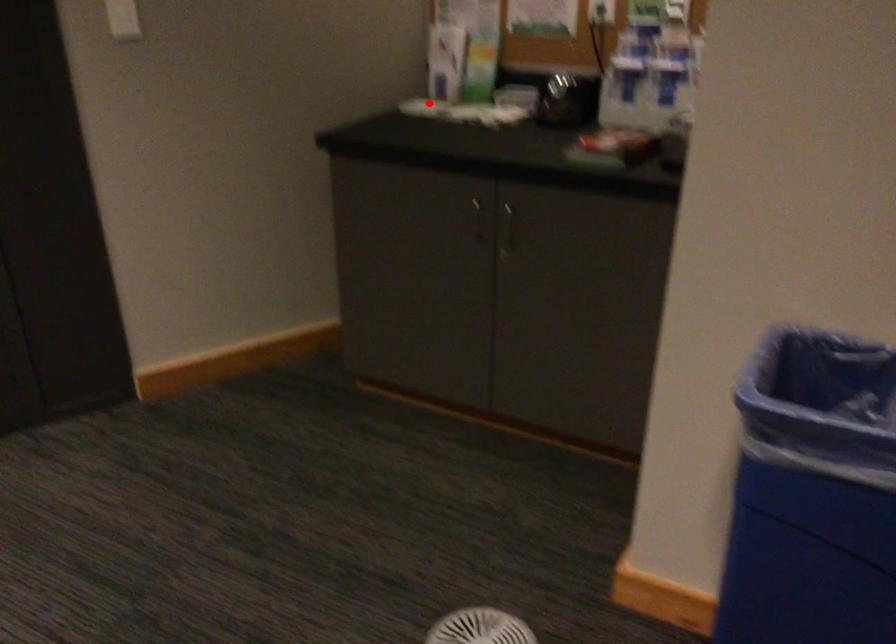
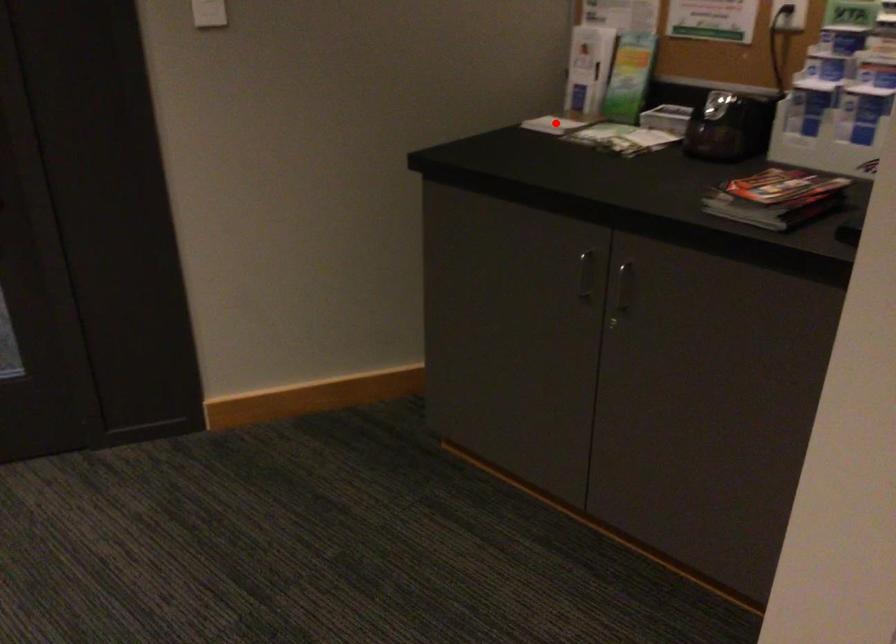
I am providing you with two images of the same scene from different viewpoints. A red point is marked on the first image and another point is marked on the second image. Are the points marked in image1 and image2 representing the same 3D position?

Yes